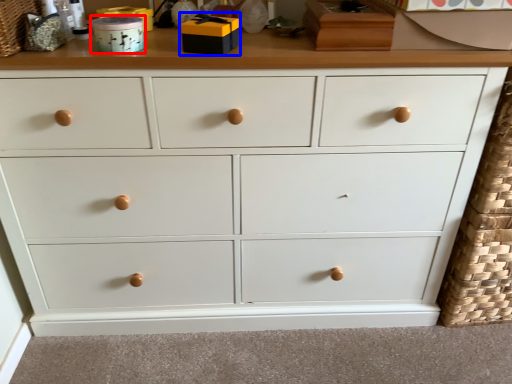
Question: Which point is further to the camera, toy (highlighted by a red box) or toy (highlighted by a blue box)?

Choices:
 (A) toy
 (B) toy

Answer: (A)